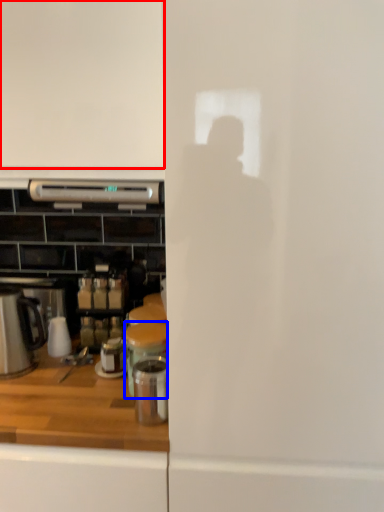
Question: Among these objects, which one is nearest to the camera, home appliance (highlighted by a red box) or appliance (highlighted by a blue box)?

Choices:
 (A) home appliance
 (B) appliance

Answer: (A)